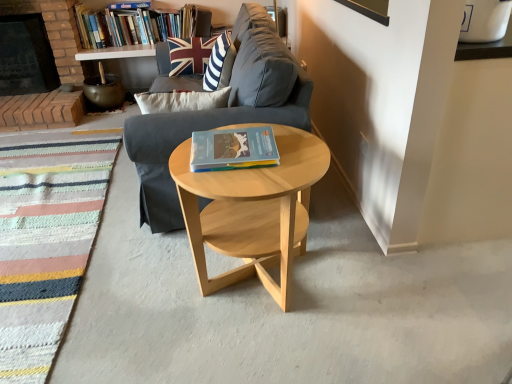
In order to click on vacant space to the left of natural wood side table at center in this screenshot , I will do `click(135, 288)`.